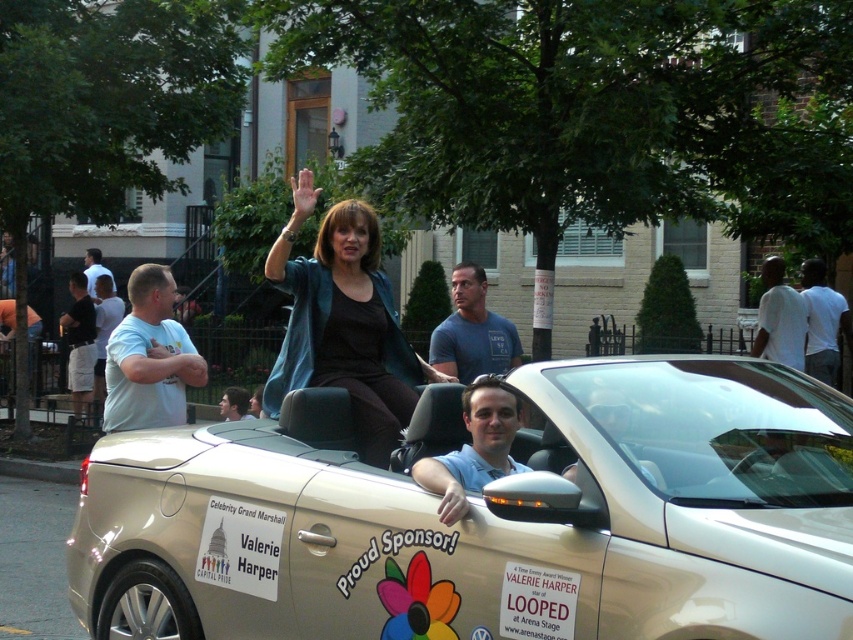
Based on the scene description, can you determine the spatial relationship between the gold metallic convertible at center and the matte blue jacket at center?

The gold metallic convertible at center is below matte blue jacket at center.

You are standing on the sidewalk watching the convertible car in the parade. There are two points marked on the car. The first point is at coordinate point (x=602, y=528) and the second point is at coordinate point (x=308, y=301). Which point is closer to the front of the car?

Point (x=602, y=528) is in front of point (x=308, y=301), so the first point is closer to the front of the car.

You are a photographer standing on the sidewalk. You want to take a photo of the gold metallic convertible at center and the matte blue jacket at center. If you want to ensure both are fully visible in the frame, which object should you focus on to avoid cropping?

You should focus on the gold metallic convertible at center because it is wider than the matte blue jacket at center, so centering on the larger object ensures both fit within the frame.